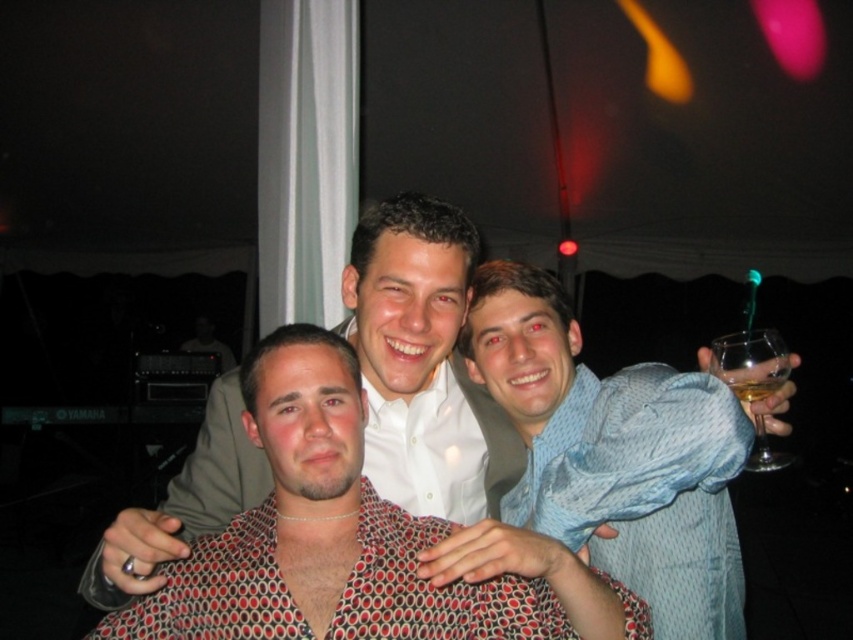
What are the coordinates of the blue textured shirt at center?

The blue textured shirt at center is located at coordinates point (614, 452).

You are a photographer trying to capture a group photo of the polka dot shirt at center and the blue textured shirt at center. Since you want to ensure both shirts are clearly visible, which shirt should you focus on to account for their sizes?

The polka dot shirt at center is wider than the blue textured shirt at center, so focusing on the polka dot shirt at center would ensure both are clearly visible as it takes up more space in the frame.

You are a photographer taking a picture of the scene. You notice the polka dot shirt at center and the clear glass wine glass at right. Which object is positioned lower in the frame?

The polka dot shirt at center is located below the clear glass wine glass at right, so it is positioned lower in the frame.